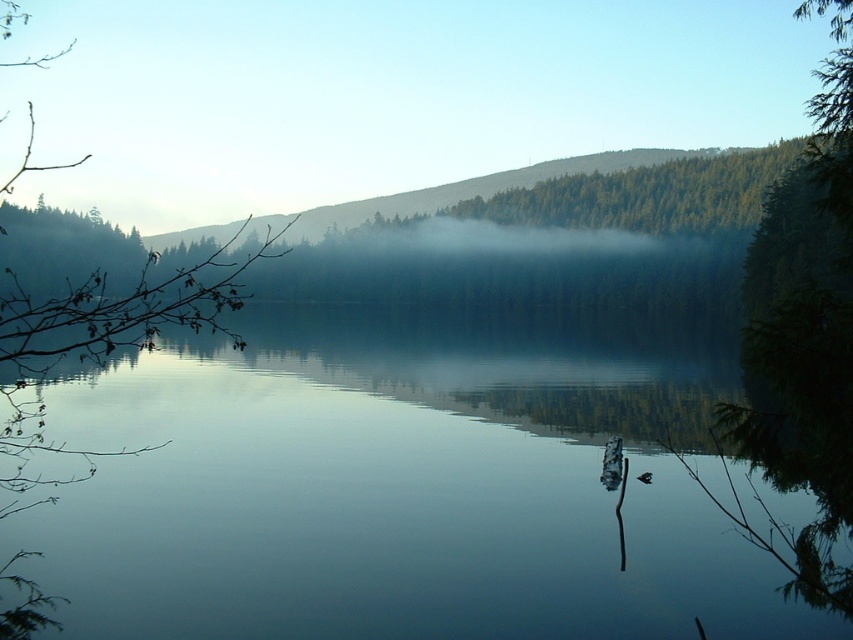
Is transparent water at center shorter than green matte branch at left?

Yes.

At what (x,y) coordinates should I click in order to perform the action: click on transparent water at center. Please return your answer as a coordinate pair (x, y). This screenshot has height=640, width=853. Looking at the image, I should click on (404, 484).

What do you see at coordinates (404, 484) in the screenshot? The width and height of the screenshot is (853, 640). I see `transparent water at center` at bounding box center [404, 484].

Identify the location of transparent water at center. This screenshot has height=640, width=853. (404, 484).